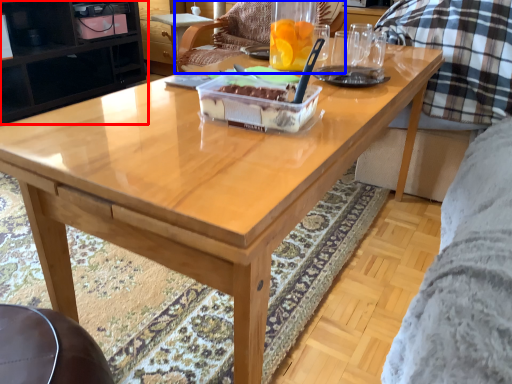
Question: Among these objects, which one is farthest to the camera, cabinetry (highlighted by a red box) or chair (highlighted by a blue box)?

Choices:
 (A) cabinetry
 (B) chair

Answer: (A)